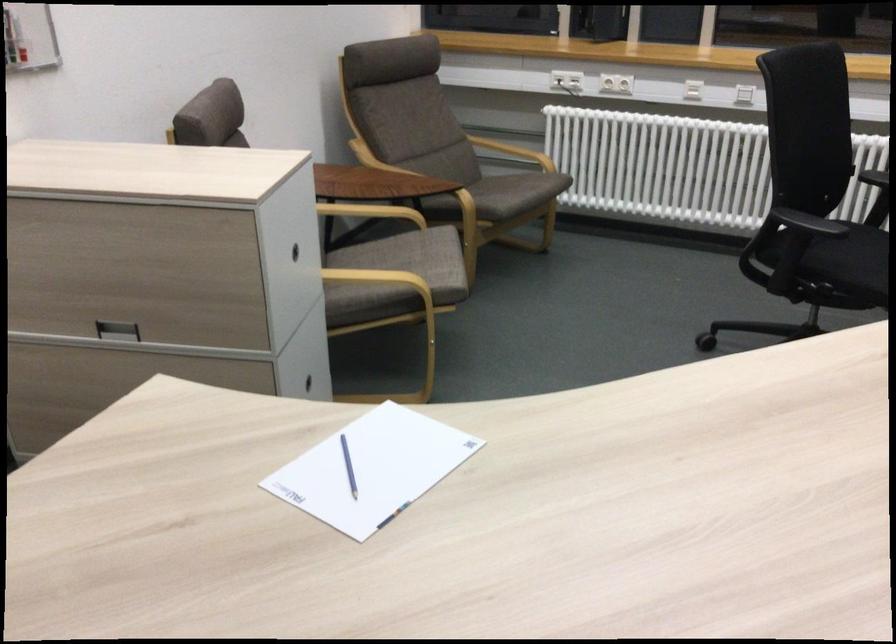
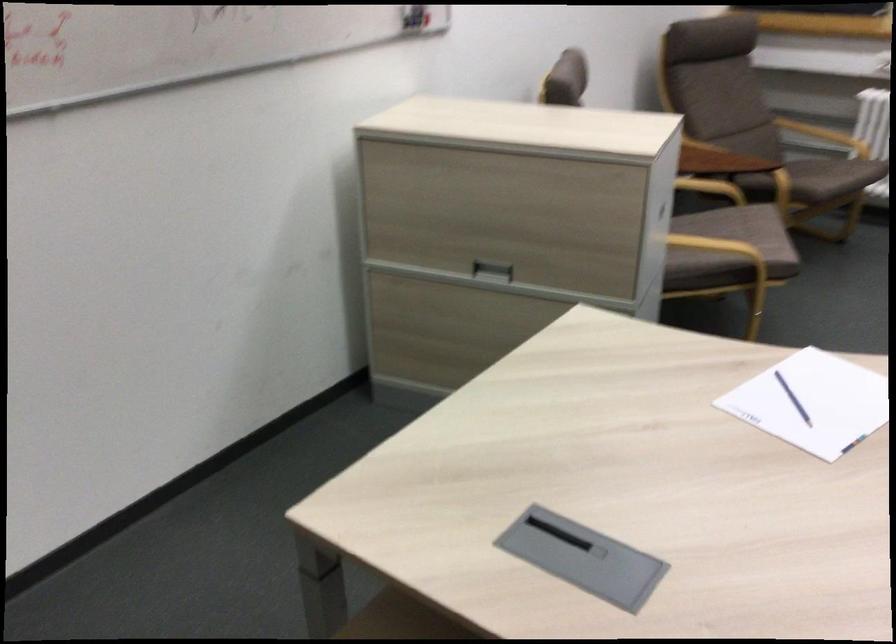
What movement of the cameraman would produce the second image?

The cameraman walked toward left, backward.